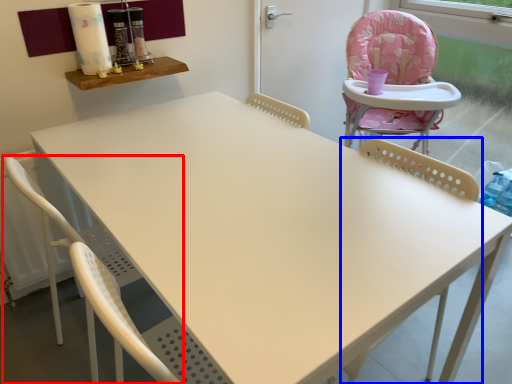
Question: Which object appears closest to the camera in this image, chair (highlighted by a red box) or chair (highlighted by a blue box)?

Choices:
 (A) chair
 (B) chair

Answer: (B)